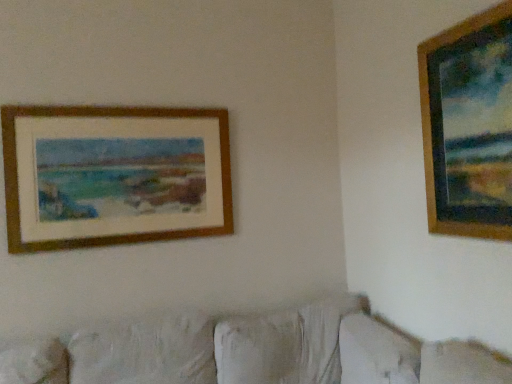
Question: Considering the relative positions of wooden frame at upper left, marked as the 1th picture frame in a back-to-front arrangement, and white fabric couch at lower center in the image provided, is wooden frame at upper left, marked as the 1th picture frame in a back-to-front arrangement, behind white fabric couch at lower center?

Choices:
 (A) no
 (B) yes

Answer: (B)

Question: Is white fabric couch at lower center located within wooden frame at upper left, the first picture frame from the left?

Choices:
 (A) no
 (B) yes

Answer: (A)

Question: Is wooden frame at upper left, the 2th picture frame viewed from the right, at the right side of white fabric couch at lower center?

Choices:
 (A) no
 (B) yes

Answer: (A)

Question: Is wooden frame at upper left, which appears as the second picture frame when viewed from the front, with white fabric couch at lower center?

Choices:
 (A) yes
 (B) no

Answer: (B)

Question: Is wooden frame at upper left, marked as the 1th picture frame in a back-to-front arrangement, shorter than white fabric couch at lower center?

Choices:
 (A) no
 (B) yes

Answer: (A)

Question: Is wooden frame at upper left, the first picture frame from the left, thinner than white fabric couch at lower center?

Choices:
 (A) no
 (B) yes

Answer: (B)

Question: Does white fabric couch at lower center turn towards wooden frame at upper right, arranged as the second picture frame when viewed from the back?

Choices:
 (A) no
 (B) yes

Answer: (A)

Question: From the image's perspective, does white fabric couch at lower center appear lower than wooden frame at upper right, acting as the 1th picture frame starting from the front?

Choices:
 (A) no
 (B) yes

Answer: (B)

Question: Is white fabric couch at lower center facing away from wooden frame at upper right, arranged as the second picture frame when viewed from the back?

Choices:
 (A) yes
 (B) no

Answer: (B)

Question: Is the position of white fabric couch at lower center more distant than that of wooden frame at upper right, which is the 1th picture frame in right-to-left order?

Choices:
 (A) no
 (B) yes

Answer: (A)

Question: From a real-world perspective, is white fabric couch at lower center located higher than wooden frame at upper right, which is the 1th picture frame in right-to-left order?

Choices:
 (A) yes
 (B) no

Answer: (B)

Question: Is white fabric couch at lower center thinner than wooden frame at upper right, placed as the second picture frame when sorted from left to right?

Choices:
 (A) yes
 (B) no

Answer: (B)

Question: Is wooden frame at upper right, arranged as the second picture frame when viewed from the back, bigger than wooden frame at upper left, which appears as the second picture frame when viewed from the front?

Choices:
 (A) no
 (B) yes

Answer: (A)